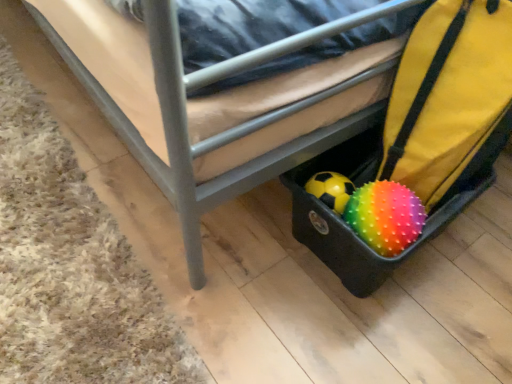
Where is `vacant region to the left of rubberized black suitcase at lower right`? The image size is (512, 384). vacant region to the left of rubberized black suitcase at lower right is located at coordinates (248, 252).